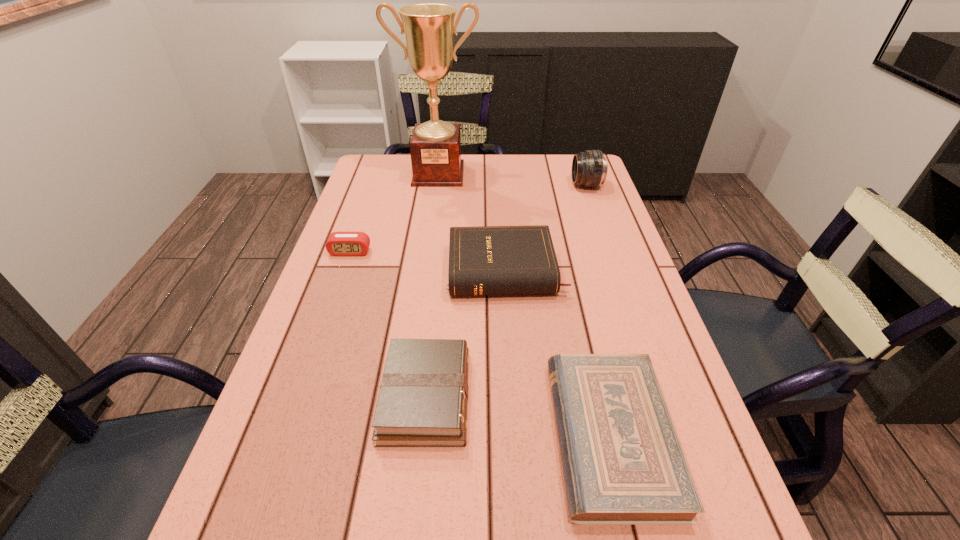
Locate an element on the screen. The height and width of the screenshot is (540, 960). empty space between the leftmost object and the second shortest Bible is located at coordinates (388, 324).

Image resolution: width=960 pixels, height=540 pixels. I want to click on empty location between the leftmost object and the farthest Bible, so click(428, 261).

Locate an element on the screen. This screenshot has height=540, width=960. free spot between the trophy cup and the fifth shortest object is located at coordinates (513, 179).

At what (x,y) coordinates should I click in order to perform the action: click on blank region between the shortest Bible and the telephoto lens. Please return your answer as a coordinate pair (x, y). Looking at the image, I should click on (599, 310).

The width and height of the screenshot is (960, 540). Find the location of `vacant area between the shortest Bible and the second shortest Bible`. vacant area between the shortest Bible and the second shortest Bible is located at coordinates [518, 416].

The width and height of the screenshot is (960, 540). What are the coordinates of `blank region between the shortest Bible and the leftmost object` in the screenshot? It's located at (481, 344).

The image size is (960, 540). Find the location of `empty location between the second shortest Bible and the leftmost object`. empty location between the second shortest Bible and the leftmost object is located at coordinates (388, 324).

This screenshot has height=540, width=960. I want to click on vacant space in between the shortest object and the leftmost object, so click(481, 344).

Identify which object is located as the third nearest to the second tallest Bible. Please provide its 2D coordinates. Your answer should be formatted as a tuple, i.e. [(x, y)], where the tuple contains the x and y coordinates of a point satisfying the conditions above.

[(339, 243)]

Identify which object is the fifth closest to the tallest Bible. Please provide its 2D coordinates. Your answer should be formatted as a tuple, i.e. [(x, y)], where the tuple contains the x and y coordinates of a point satisfying the conditions above.

[(435, 147)]